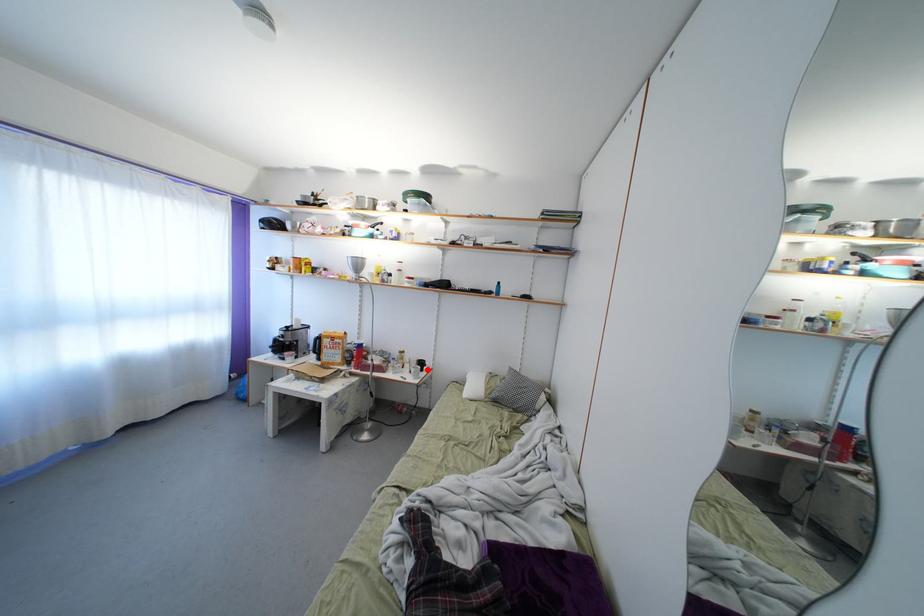
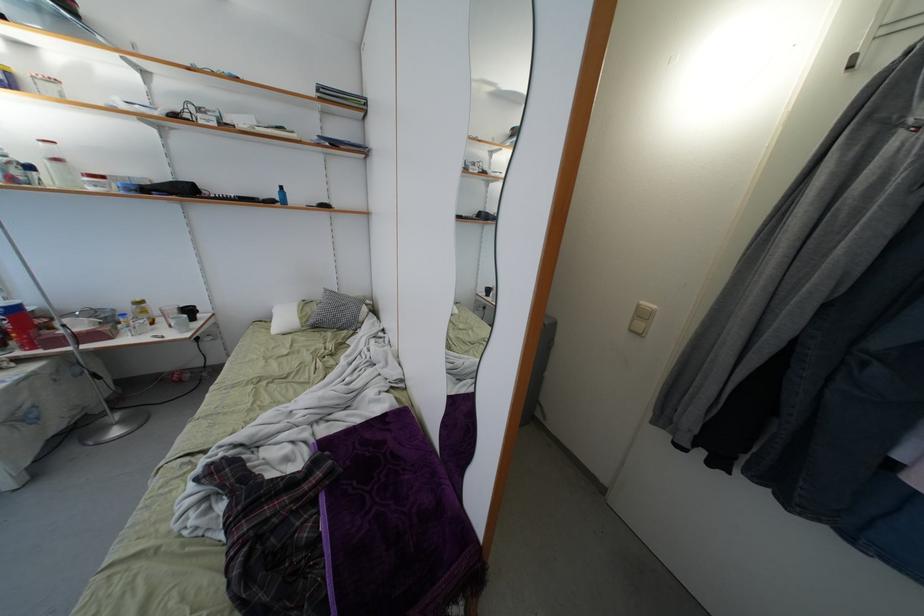
Find the pixel in the second image that matches the highlighted location in the first image.

(195, 315)